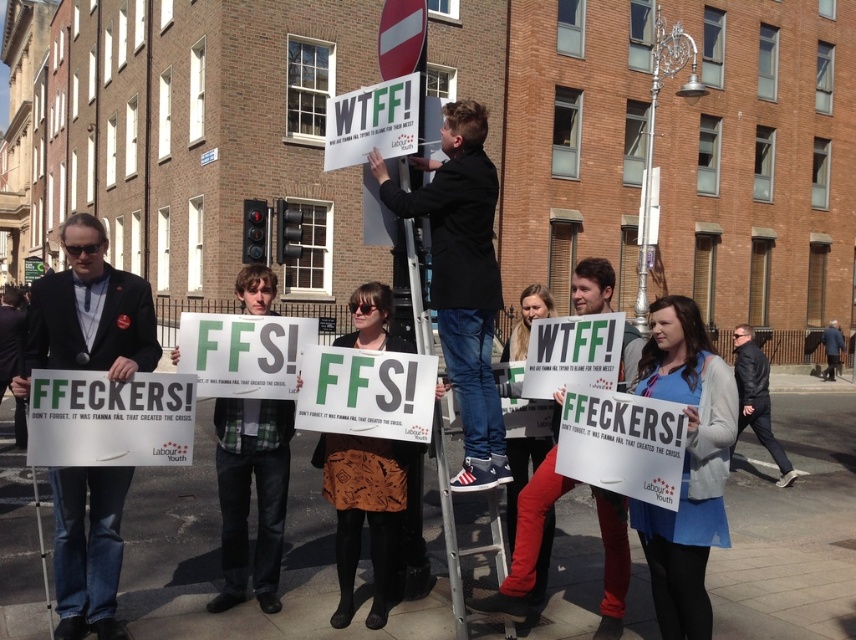
Question: Can you confirm if white paper sign at upper center is positioned to the right of black leather jacket at center?

Choices:
 (A) no
 (B) yes

Answer: (A)

Question: Which object appears farthest from the camera in this image?

Choices:
 (A) dark blue wool coat at lower right
 (B) black leather jacket at center

Answer: (A)

Question: Based on their relative distances, which object is nearer to the white paper sign at upper center?

Choices:
 (A) black leather jacket at center
 (B) matte black jacket at left
 (C) dark blue wool coat at lower right
 (D) white paper sign at center

Answer: (B)

Question: Is dark blue jeans at center above dark blue wool coat at lower right?

Choices:
 (A) yes
 (B) no

Answer: (A)

Question: Which object appears closest to the camera in this image?

Choices:
 (A) dark blue jeans at center
 (B) white paper sign at upper center

Answer: (A)

Question: Is white paper sign at upper center thinner than dark blue wool coat at lower right?

Choices:
 (A) no
 (B) yes

Answer: (B)